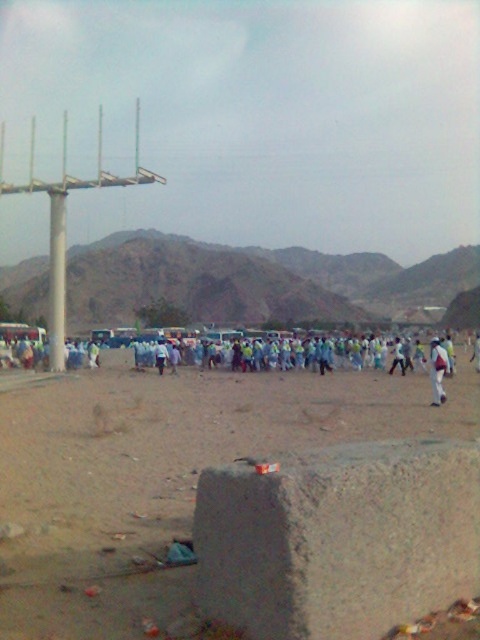
Question: Which object is closer to the camera taking this photo?

Choices:
 (A) light blue fabric at center
 (B) white concrete pillar at left
 (C) white fabric person at center

Answer: (C)

Question: Can you confirm if brown sandy dirt at center is thinner than white concrete pillar at left?

Choices:
 (A) no
 (B) yes

Answer: (B)

Question: Is brown sandy dirt at center positioned behind light blue fabric at center?

Choices:
 (A) yes
 (B) no

Answer: (B)

Question: Among these objects, which one is nearest to the camera?

Choices:
 (A) light blue fabric at center
 (B) brown sandy dirt at center

Answer: (B)

Question: Does white concrete pillar at left appear on the left side of white fabric person at center?

Choices:
 (A) no
 (B) yes

Answer: (B)

Question: Among these objects, which one is farthest from the camera?

Choices:
 (A) brown sandy dirt at center
 (B) light blue fabric at center
 (C) white fabric person at right
 (D) white concrete pillar at left

Answer: (D)